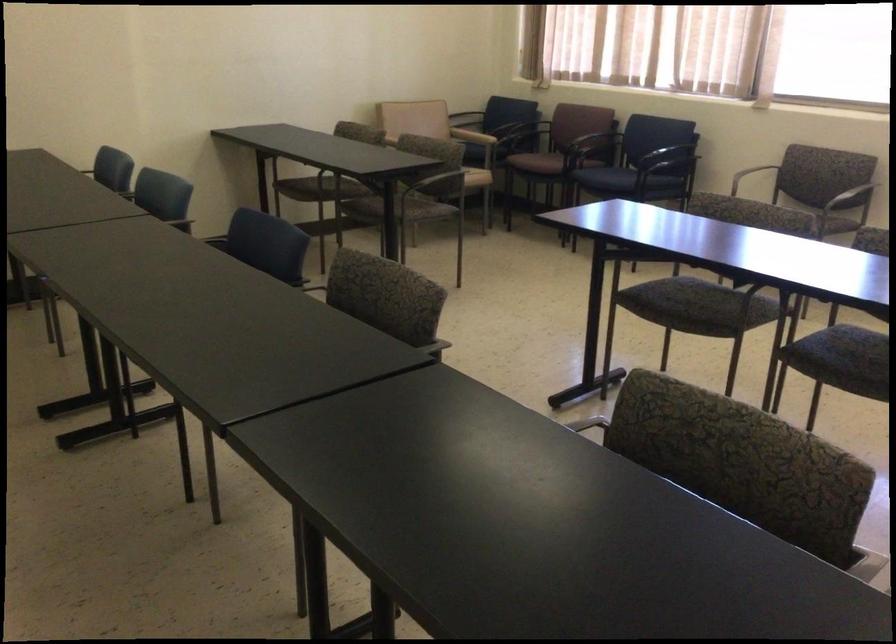
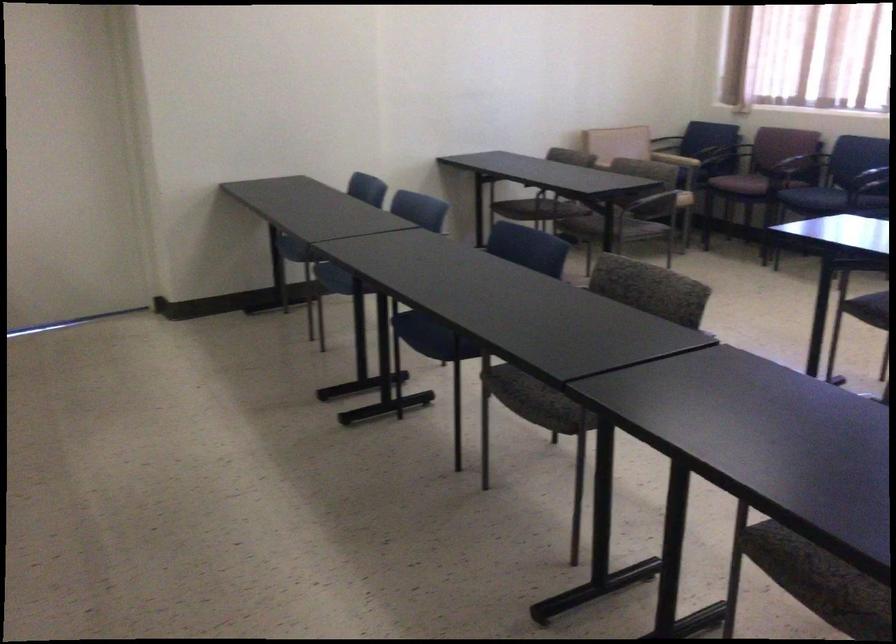
Where in the second image is the point corresponding to pixel 572 129 from the first image?

(776, 156)